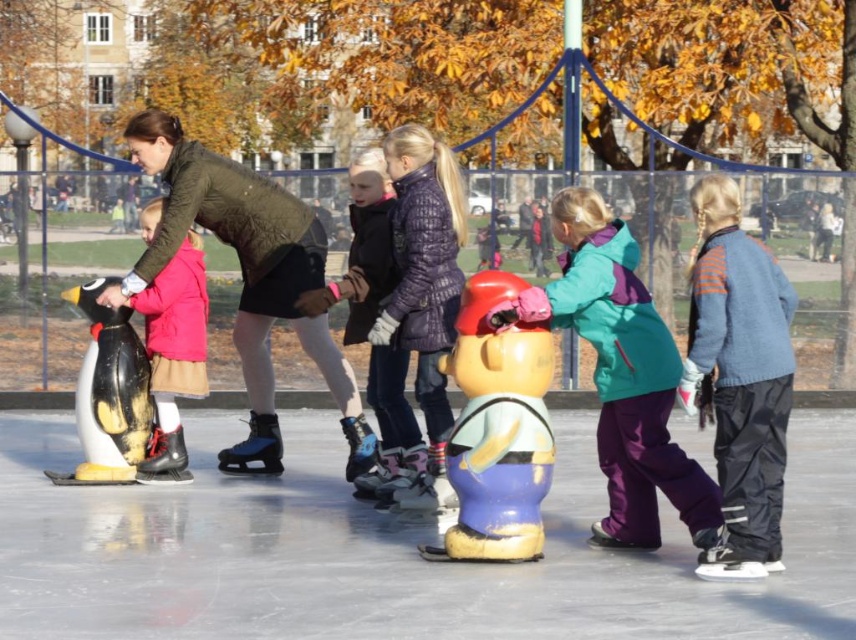
Which is above, blue rubber figure at center or matte purple jacket at center?

matte purple jacket at center

Can you confirm if blue rubber figure at center is positioned below matte purple jacket at center?

Indeed, blue rubber figure at center is positioned under matte purple jacket at center.

You are a GUI agent. You are given a task and a screenshot of the screen. Output one action in this format:
    pyautogui.click(x=<x>, y=<y>)
    Task: Click on the blue rubber figure at center
    
    Given the screenshot: What is the action you would take?
    pyautogui.click(x=388, y=550)

Does blue rubber figure at center have a lesser height compared to teal fleece jacket at center?

Yes, blue rubber figure at center is shorter than teal fleece jacket at center.

Between point (842, 445) and point (551, 198), which one is positioned in front?

Point (551, 198)

Identify the location of blue rubber figure at center. This screenshot has width=856, height=640. (388, 550).

Does teal fleece jacket at center come behind white matte penguin at left?

That is False.

This screenshot has height=640, width=856. I want to click on teal fleece jacket at center, so click(623, 374).